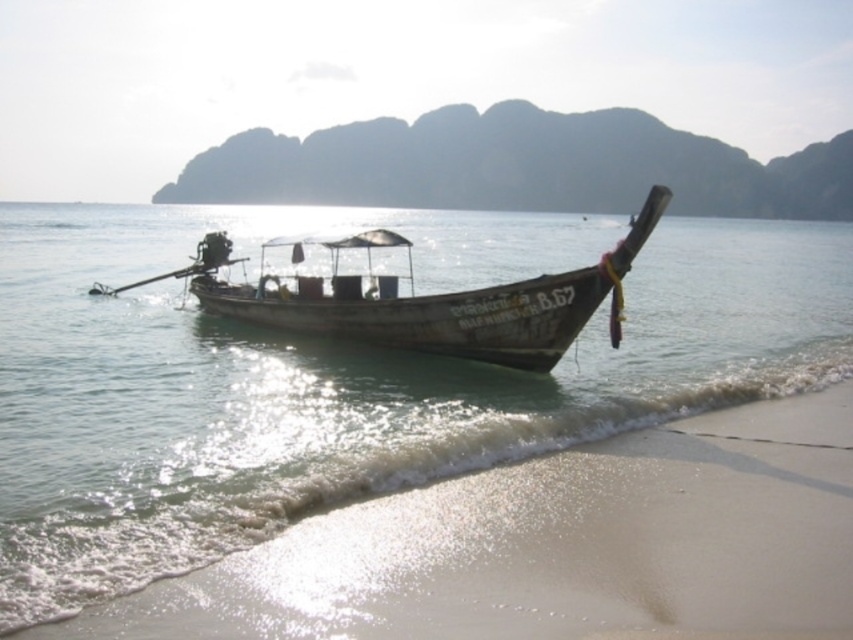
Question: Which point is closer to the camera?

Choices:
 (A) (457, 312)
 (B) (68, 500)

Answer: (B)

Question: Among these objects, which one is nearest to the camera?

Choices:
 (A) translucent water at boat center
 (B) wooden boat at center

Answer: (A)

Question: From the image, what is the correct spatial relationship of translucent water at boat center in relation to wooden boat at center?

Choices:
 (A) right
 (B) left

Answer: (A)

Question: Does translucent water at boat center appear under wooden boat at center?

Choices:
 (A) yes
 (B) no

Answer: (B)

Question: Is translucent water at boat center thinner than wooden boat at center?

Choices:
 (A) yes
 (B) no

Answer: (B)